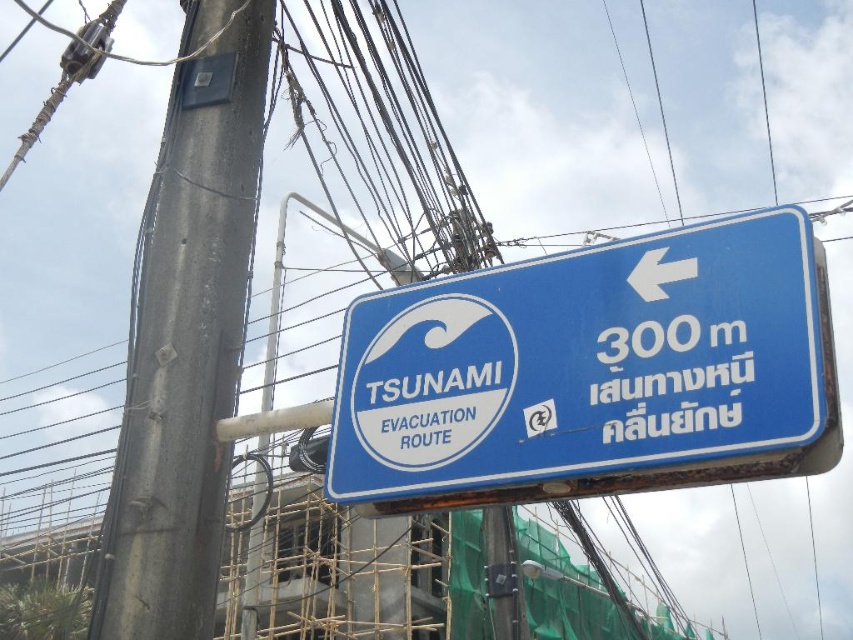
Who is more forward, (x=730, y=451) or (x=218, y=96)?

Point (x=730, y=451)

Which is more to the right, blue plastic sign at upper center or gray concrete pole at left?

From the viewer's perspective, blue plastic sign at upper center appears more on the right side.

Measure the distance between blue plastic sign at upper center and camera.

A distance of 16.00 feet exists between blue plastic sign at upper center and camera.

You are a GUI agent. You are given a task and a screenshot of the screen. Output one action in this format:
    pyautogui.click(x=<x>, y=<y>)
    Task: Click on the blue plastic sign at upper center
    Image resolution: width=853 pixels, height=640 pixels.
    Given the screenshot: What is the action you would take?
    pyautogui.click(x=592, y=372)